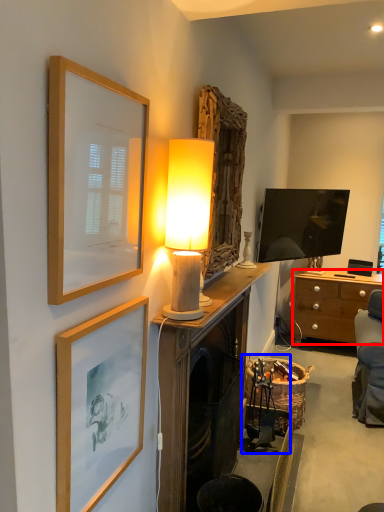
Question: Among these objects, which one is nearest to the camera, desk (highlighted by a red box) or swivel chair (highlighted by a blue box)?

Choices:
 (A) desk
 (B) swivel chair

Answer: (B)